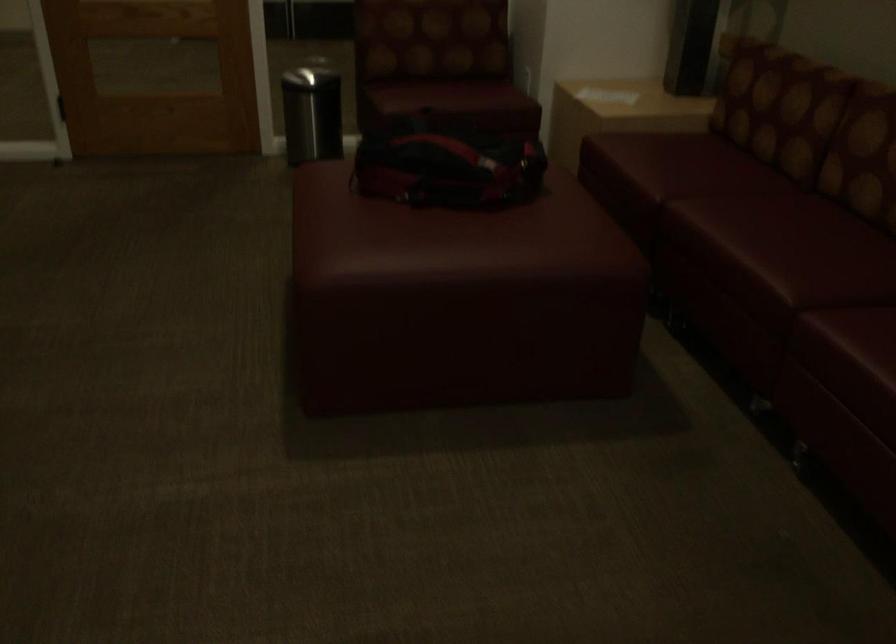
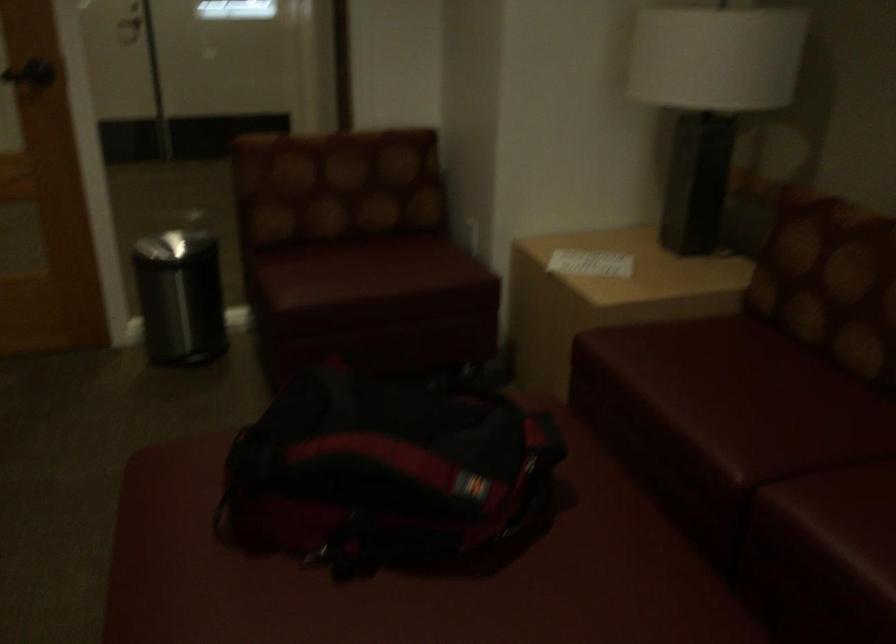
In the second image, find the point that corresponds to point (673, 162) in the first image.

(731, 397)